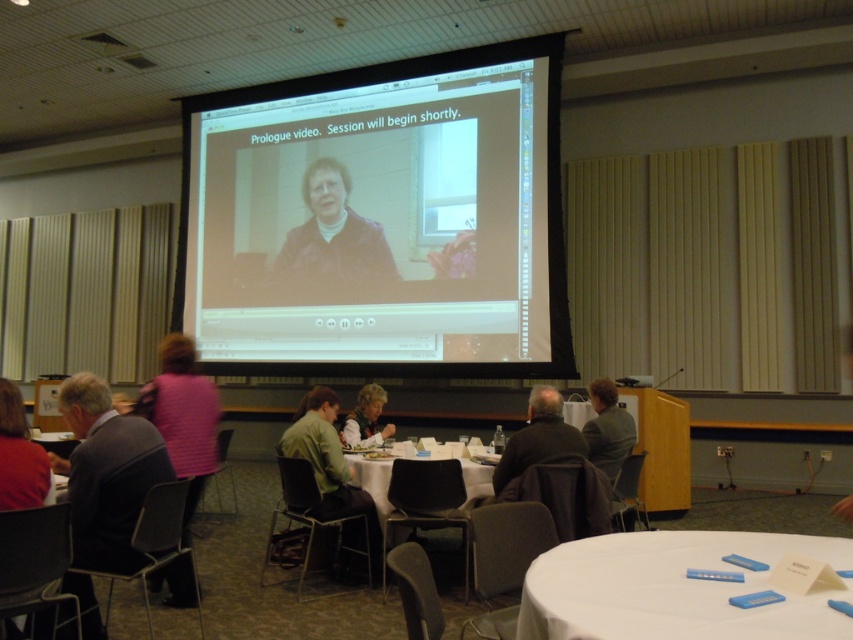
Is point (378, 525) positioned behind point (357, 410)?

No, it is in front of (357, 410).

Consider the image. Is green fabric jacket at lower center to the right of matte green sweater at center from the viewer's perspective?

In fact, green fabric jacket at lower center is to the left of matte green sweater at center.

Image resolution: width=853 pixels, height=640 pixels. What do you see at coordinates (334, 477) in the screenshot?
I see `green fabric jacket at lower center` at bounding box center [334, 477].

Find the location of a particular element. green fabric jacket at lower center is located at coordinates (334, 477).

Based on the photo, who is positioned more to the right, pink textured sweater at lower left or white plastic table at center?

white plastic table at center is more to the right.

Find the location of a particular element. pink textured sweater at lower left is located at coordinates (183, 417).

Does point (173, 568) lie in front of point (457, 500)?

Yes, point (173, 568) is in front of point (457, 500).

Identify the location of pink textured sweater at lower left. (183, 417).

Is point (514, 125) less distant than point (614, 397)?

No, (514, 125) is behind (614, 397).

You are a GUI agent. You are given a task and a screenshot of the screen. Output one action in this format:
    pyautogui.click(x=<x>, y=<y>)
    Task: Click on the matte black projector screen at upper center
    This screenshot has height=640, width=853.
    Given the screenshot: What is the action you would take?
    pyautogui.click(x=380, y=220)

This screenshot has width=853, height=640. I want to click on matte black projector screen at upper center, so click(x=380, y=220).